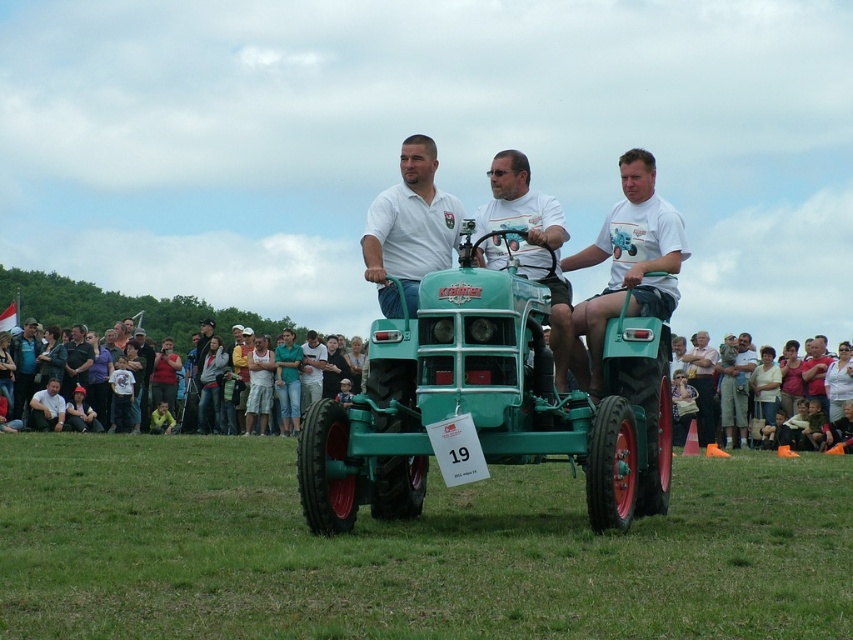
Question: Which point is farther to the camera?

Choices:
 (A) (639, 280)
 (B) (460, 220)
 (C) (747, 387)
 (D) (335, 381)

Answer: (D)

Question: Can you confirm if white cotton shirt at center is wider than matte white shirt at center?

Choices:
 (A) yes
 (B) no

Answer: (A)

Question: Is matte green tractor at center below light brown leather jacket at center?

Choices:
 (A) no
 (B) yes

Answer: (A)

Question: In this image, where is white cotton shirt at center located relative to dark gray shirt at center?

Choices:
 (A) below
 (B) above

Answer: (A)

Question: Which point is farther from the camera taking this photo?

Choices:
 (A) (x=683, y=563)
 (B) (x=628, y=193)
 (C) (x=427, y=161)

Answer: (C)

Question: Estimate the real-world distances between objects in this image. Which object is closer to the green matte tractor at center?

Choices:
 (A) matte green tractor at center
 (B) white cotton t-shirt at center
 (C) dark gray shirt at center

Answer: (A)